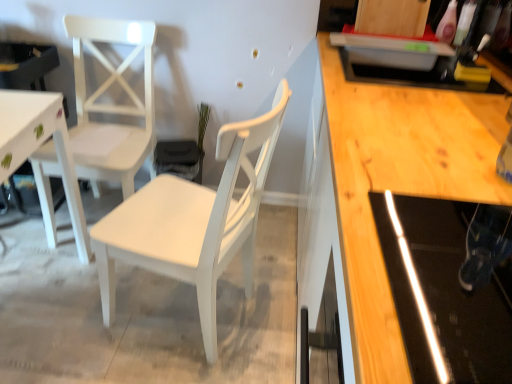
How much space does white painted wood chair at center, marked as the second chair in a left-to-right arrangement, occupy vertically?

white painted wood chair at center, marked as the second chair in a left-to-right arrangement, is 35.66 inches tall.

Image resolution: width=512 pixels, height=384 pixels. I want to click on white painted wood chair at center, marked as the second chair in a left-to-right arrangement, so click(193, 221).

The image size is (512, 384). Describe the element at coordinates (193, 221) in the screenshot. I see `white painted wood chair at center, positioned as the 1th chair in right-to-left order` at that location.

Describe the element at coordinates (111, 105) in the screenshot. Image resolution: width=512 pixels, height=384 pixels. I see `white matte chair at left, positioned as the 2th chair in right-to-left order` at that location.

Find the location of a particular element. The height and width of the screenshot is (384, 512). white matte chair at left, positioned as the 2th chair in right-to-left order is located at coordinates (111, 105).

In the scene shown: Measure the distance between white matte chair at left, positioned as the 2th chair in right-to-left order, and camera.

The depth of white matte chair at left, positioned as the 2th chair in right-to-left order, is 5.56 feet.

The width and height of the screenshot is (512, 384). In order to click on white painted wood chair at center, positioned as the 1th chair in right-to-left order in this screenshot , I will do `click(193, 221)`.

Is white painted wood chair at center, marked as the second chair in a left-to-right arrangement, to the right of white matte chair at left, the 1th chair in the left-to-right sequence, from the viewer's perspective?

Correct, you'll find white painted wood chair at center, marked as the second chair in a left-to-right arrangement, to the right of white matte chair at left, the 1th chair in the left-to-right sequence.

Is the position of white painted wood chair at center, marked as the second chair in a left-to-right arrangement, more distant than that of white matte chair at left, the 1th chair in the left-to-right sequence?

No, it is in front of white matte chair at left, the 1th chair in the left-to-right sequence.

Is point (227, 200) farther from viewer compared to point (151, 67)?

No.

From the image's perspective, is white painted wood chair at center, positioned as the 1th chair in right-to-left order, located above or below white matte chair at left, the 1th chair in the left-to-right sequence?

white painted wood chair at center, positioned as the 1th chair in right-to-left order, is situated lower than white matte chair at left, the 1th chair in the left-to-right sequence, in the image.

From a real-world perspective, is white painted wood chair at center, positioned as the 1th chair in right-to-left order, beneath white matte chair at left, the 1th chair in the left-to-right sequence?

Incorrect, from a real-world perspective, white painted wood chair at center, positioned as the 1th chair in right-to-left order, is higher than white matte chair at left, the 1th chair in the left-to-right sequence.

Is white painted wood chair at center, positioned as the 1th chair in right-to-left order, wider or thinner than white matte chair at left, positioned as the 2th chair in right-to-left order?

Clearly, white painted wood chair at center, positioned as the 1th chair in right-to-left order, has more width compared to white matte chair at left, positioned as the 2th chair in right-to-left order.

Based on the photo, which of these two, white painted wood chair at center, positioned as the 1th chair in right-to-left order, or white matte chair at left, the 1th chair in the left-to-right sequence, stands taller?

white matte chair at left, the 1th chair in the left-to-right sequence, is taller.

Considering the relative sizes of white painted wood chair at center, marked as the second chair in a left-to-right arrangement, and white matte chair at left, positioned as the 2th chair in right-to-left order, in the image provided, is white painted wood chair at center, marked as the second chair in a left-to-right arrangement, bigger than white matte chair at left, positioned as the 2th chair in right-to-left order,?

Yes.

Is white painted wood chair at center, marked as the second chair in a left-to-right arrangement, not inside white matte chair at left, positioned as the 2th chair in right-to-left order?

Yes.

Would you consider white painted wood chair at center, positioned as the 1th chair in right-to-left order, to be distant from white matte chair at left, positioned as the 2th chair in right-to-left order?

That's not correct — white painted wood chair at center, positioned as the 1th chair in right-to-left order, is a little close to white matte chair at left, positioned as the 2th chair in right-to-left order.

Is white painted wood chair at center, marked as the second chair in a left-to-right arrangement, facing towards white matte chair at left, the 1th chair in the left-to-right sequence?

No, white painted wood chair at center, marked as the second chair in a left-to-right arrangement, does not turn towards white matte chair at left, the 1th chair in the left-to-right sequence.

Find the location of `chair behind the white painted wood chair at center, marked as the second chair in a left-to-right arrangement`. chair behind the white painted wood chair at center, marked as the second chair in a left-to-right arrangement is located at coordinates (111, 105).

Would you say white matte chair at left, positioned as the 2th chair in right-to-left order, is to the left or to the right of white painted wood chair at center, positioned as the 1th chair in right-to-left order, in the picture?

Based on their positions, white matte chair at left, positioned as the 2th chair in right-to-left order, is located to the left of white painted wood chair at center, positioned as the 1th chair in right-to-left order.

Consider the image. Is white matte chair at left, positioned as the 2th chair in right-to-left order, closer to camera compared to white painted wood chair at center, marked as the second chair in a left-to-right arrangement?

No.

Is point (131, 140) positioned before point (112, 318)?

That is False.

From the image's perspective, is white matte chair at left, the 1th chair in the left-to-right sequence, located above or below white painted wood chair at center, positioned as the 1th chair in right-to-left order?

From the image's perspective, white matte chair at left, the 1th chair in the left-to-right sequence, appears above white painted wood chair at center, positioned as the 1th chair in right-to-left order.

From a real-world perspective, between white matte chair at left, the 1th chair in the left-to-right sequence, and white painted wood chair at center, positioned as the 1th chair in right-to-left order, who is vertically higher?

white painted wood chair at center, positioned as the 1th chair in right-to-left order.

From the picture: Can you confirm if white matte chair at left, positioned as the 2th chair in right-to-left order, is thinner than white painted wood chair at center, positioned as the 1th chair in right-to-left order?

Yes.

Between white matte chair at left, positioned as the 2th chair in right-to-left order, and white painted wood chair at center, marked as the second chair in a left-to-right arrangement, which one has less height?

With less height is white painted wood chair at center, marked as the second chair in a left-to-right arrangement.

Is white matte chair at left, positioned as the 2th chair in right-to-left order, bigger or smaller than white painted wood chair at center, positioned as the 1th chair in right-to-left order?

white matte chair at left, positioned as the 2th chair in right-to-left order, is smaller than white painted wood chair at center, positioned as the 1th chair in right-to-left order.

Does white matte chair at left, the 1th chair in the left-to-right sequence, contain white painted wood chair at center, marked as the second chair in a left-to-right arrangement?

No, white painted wood chair at center, marked as the second chair in a left-to-right arrangement, is located outside of white matte chair at left, the 1th chair in the left-to-right sequence.

In the scene shown: Is white matte chair at left, the 1th chair in the left-to-right sequence, beside white painted wood chair at center, positioned as the 1th chair in right-to-left order?

There is a gap between white matte chair at left, the 1th chair in the left-to-right sequence, and white painted wood chair at center, positioned as the 1th chair in right-to-left order.

Is white matte chair at left, the 1th chair in the left-to-right sequence, turned away from white painted wood chair at center, marked as the second chair in a left-to-right arrangement?

That's not correct — white matte chair at left, the 1th chair in the left-to-right sequence, is not looking away from white painted wood chair at center, marked as the second chair in a left-to-right arrangement.

Image resolution: width=512 pixels, height=384 pixels. Identify the location of chair behind the white painted wood chair at center, positioned as the 1th chair in right-to-left order. (111, 105).

Identify the location of chair above the white matte chair at left, the 1th chair in the left-to-right sequence (from a real-world perspective). (193, 221).

This screenshot has height=384, width=512. Find the location of `chair that is in front of the white matte chair at left, positioned as the 2th chair in right-to-left order`. chair that is in front of the white matte chair at left, positioned as the 2th chair in right-to-left order is located at coordinates (193, 221).